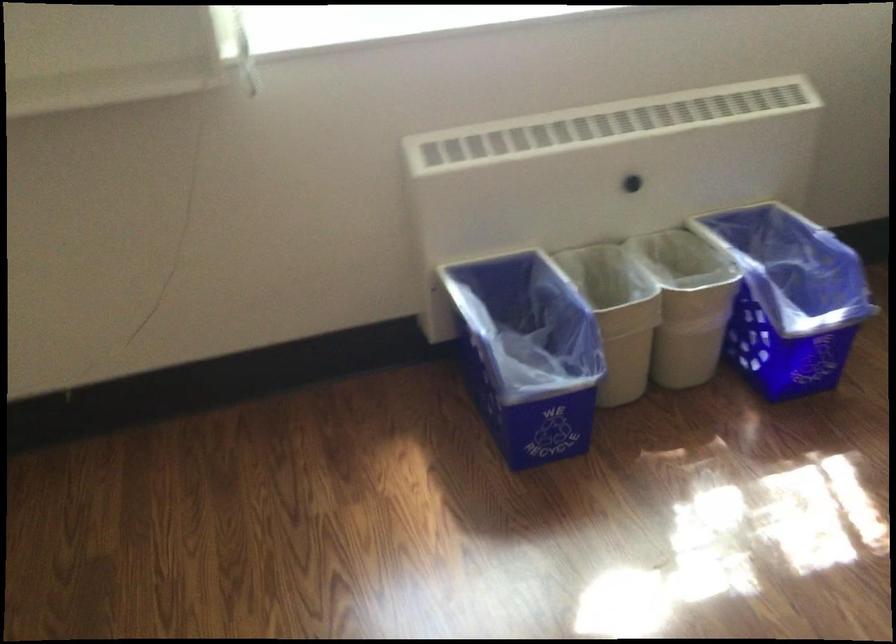
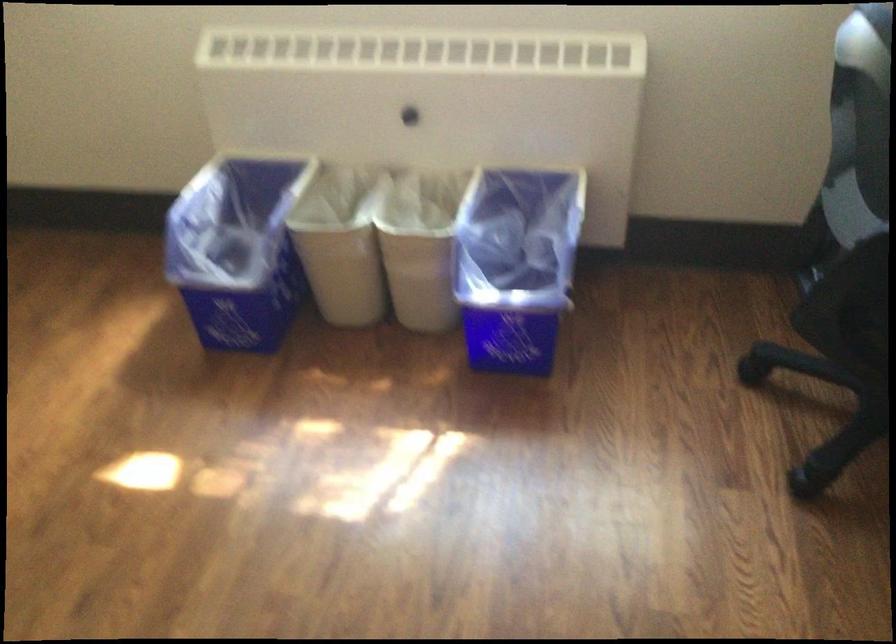
Locate, in the second image, the point that corresponds to point 755,297 in the first image.

(515, 265)